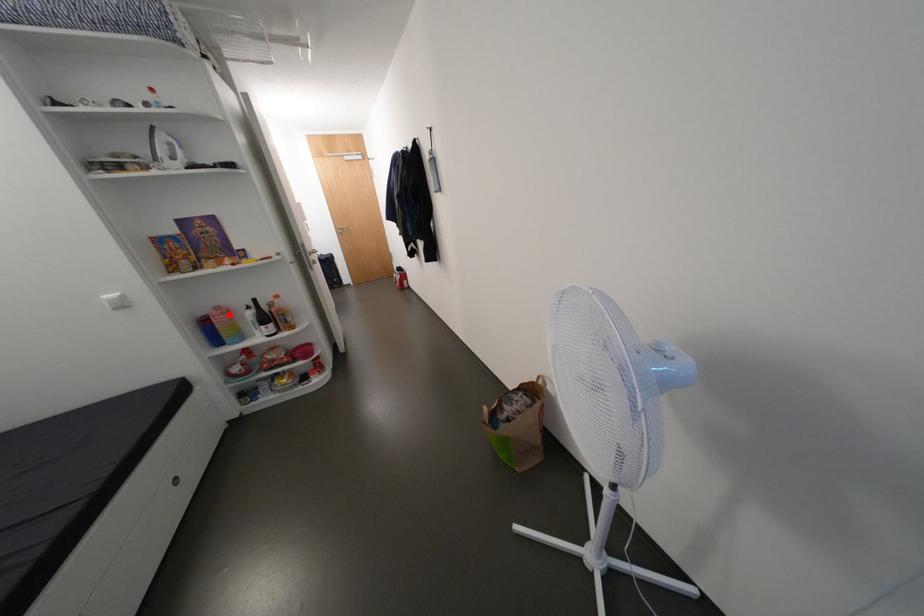
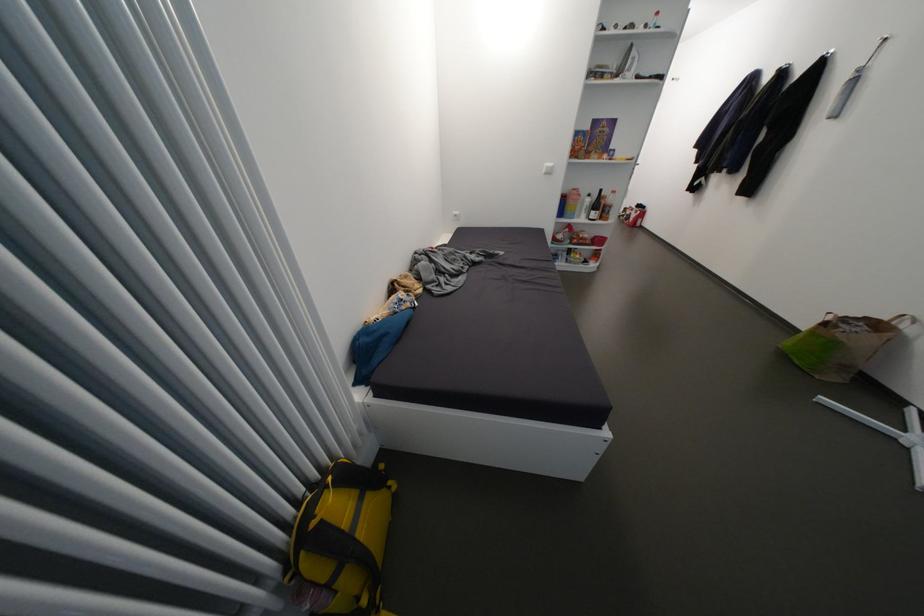
Find the pixel in the second image that matches the highlighted location in the first image.

(585, 196)